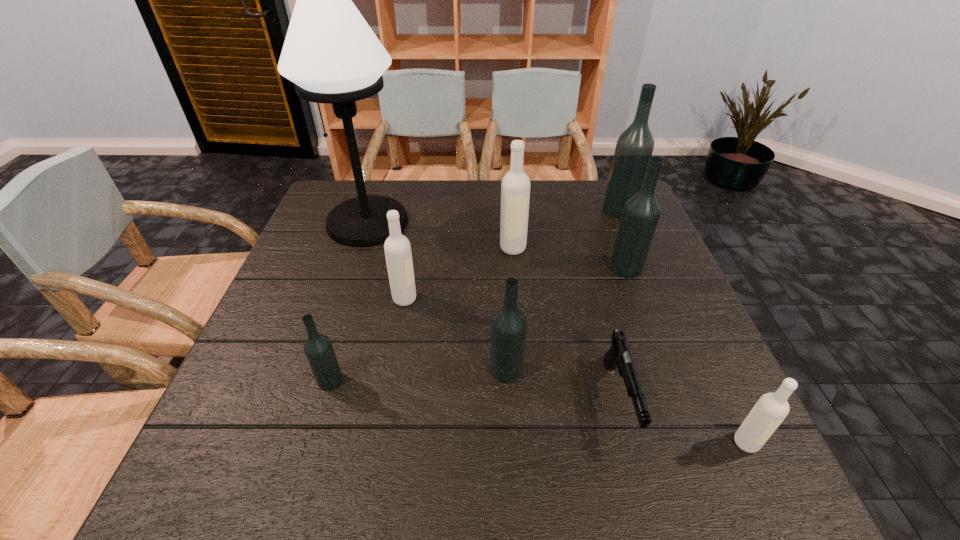
Point out which black vodka is positioned as the nearest to the second white vodka from right to left. Please provide its 2D coordinates. Your answer should be formatted as a tuple, i.e. [(x, y)], where the tuple contains the x and y coordinates of a point satisfying the conditions above.

[(641, 213)]

Locate an element on the screen. The height and width of the screenshot is (540, 960). black vodka that is the third closest one to the tallest object is located at coordinates (641, 213).

Point out which white vodka is positioned as the nearest to the second smallest white vodka. Please provide its 2D coordinates. Your answer should be formatted as a tuple, i.e. [(x, y)], where the tuple contains the x and y coordinates of a point satisfying the conditions above.

[(515, 187)]

Identify the location of white vodka object that ranks as the closest to the second white vodka from left to right. This screenshot has width=960, height=540. (397, 248).

Identify the location of free space that satisfies the following two spatial constraints: 1. on the front side of the third biggest black vodka; 2. on the left side of the tallest object. (320, 370).

Find the location of a particular element. The width and height of the screenshot is (960, 540). free space that satisfies the following two spatial constraints: 1. on the back side of the second tallest object; 2. on the left side of the smallest black vodka is located at coordinates (381, 209).

The width and height of the screenshot is (960, 540). I want to click on vacant region that satisfies the following two spatial constraints: 1. on the front side of the second smallest black vodka; 2. on the left side of the rightmost white vodka, so click(511, 443).

Find the location of a particular element. The width and height of the screenshot is (960, 540). vacant region that satisfies the following two spatial constraints: 1. on the front side of the smallest black vodka; 2. on the left side of the smallest white vodka is located at coordinates (312, 443).